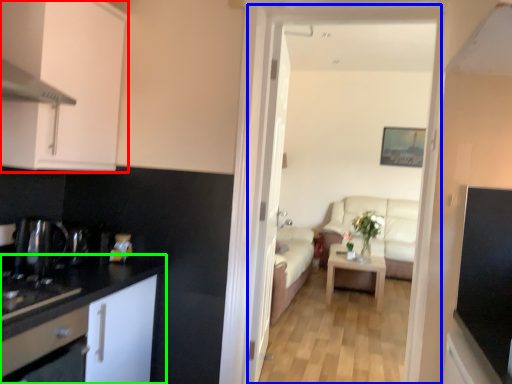
Question: Which is farther away from cabinetry (highlighted by a red box)? corridor (highlighted by a blue box) or cabinetry (highlighted by a green box)?

Choices:
 (A) corridor
 (B) cabinetry

Answer: (A)